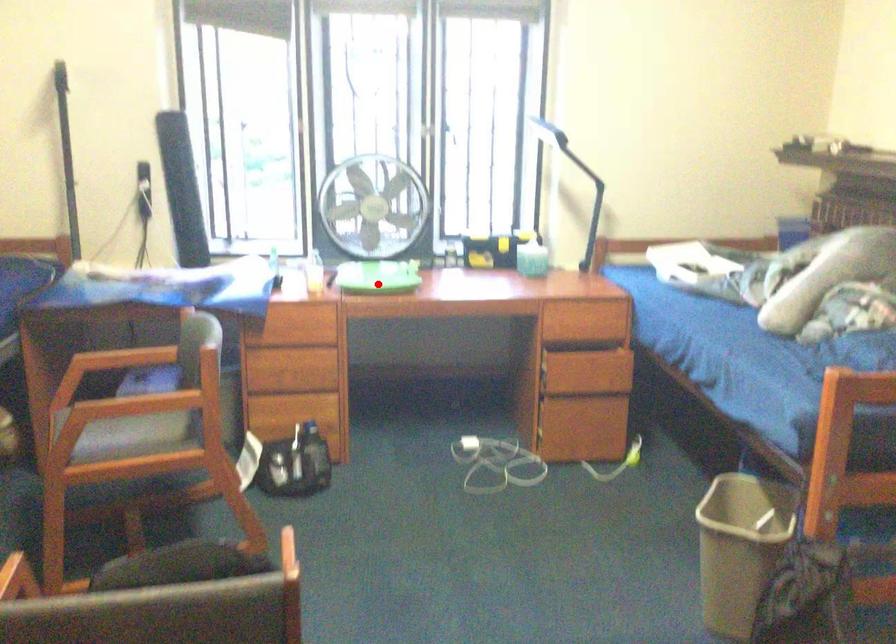
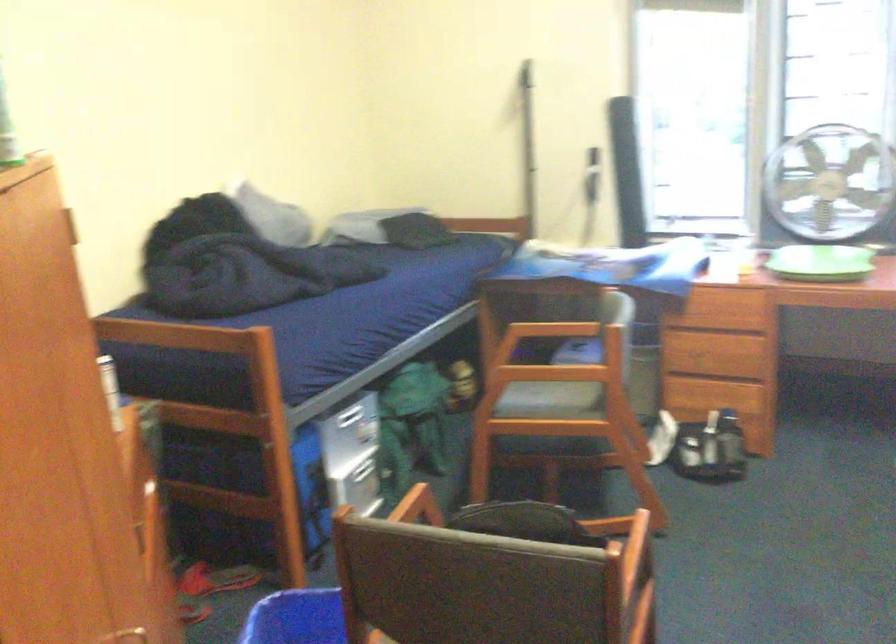
Question: A red point is marked in image1. In image2, is the corresponding 3D point closer to the camera or farther? Reply with the corresponding letter.

Choices:
 (A) The corresponding 3D point is closer.
 (B) The corresponding 3D point is farther.

Answer: (A)